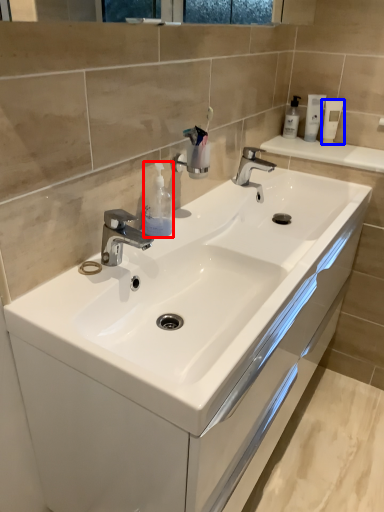
Question: Which object appears closest to the camera in this image, soap dispenser (highlighted by a red box) or mouthwash (highlighted by a blue box)?

Choices:
 (A) soap dispenser
 (B) mouthwash

Answer: (A)